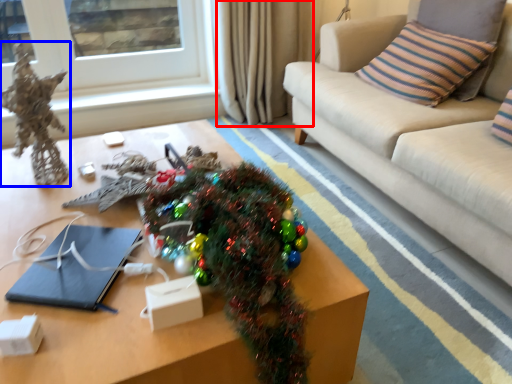
Question: Which point is closer to the camera, curtain (highlighted by a red box) or decor (highlighted by a blue box)?

Choices:
 (A) curtain
 (B) decor

Answer: (B)